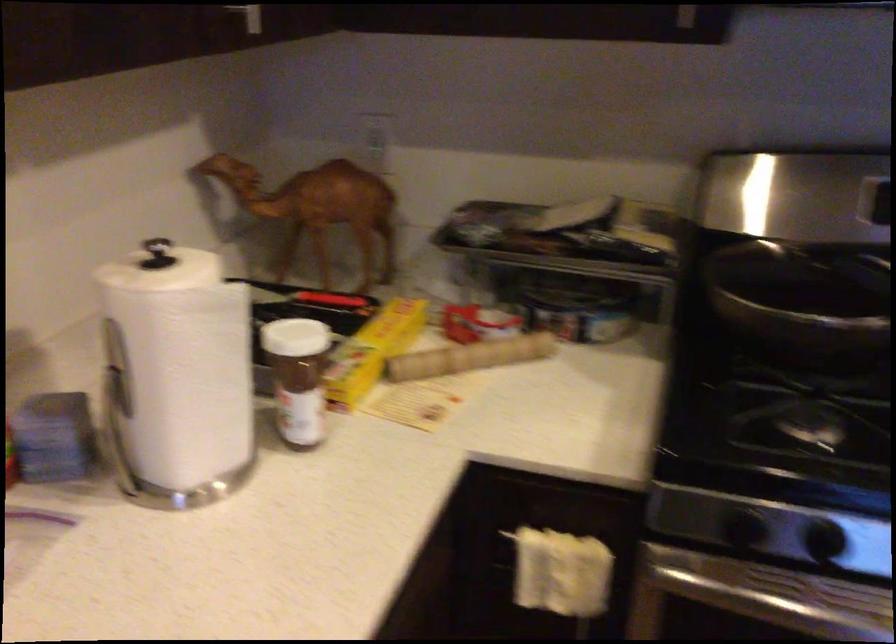
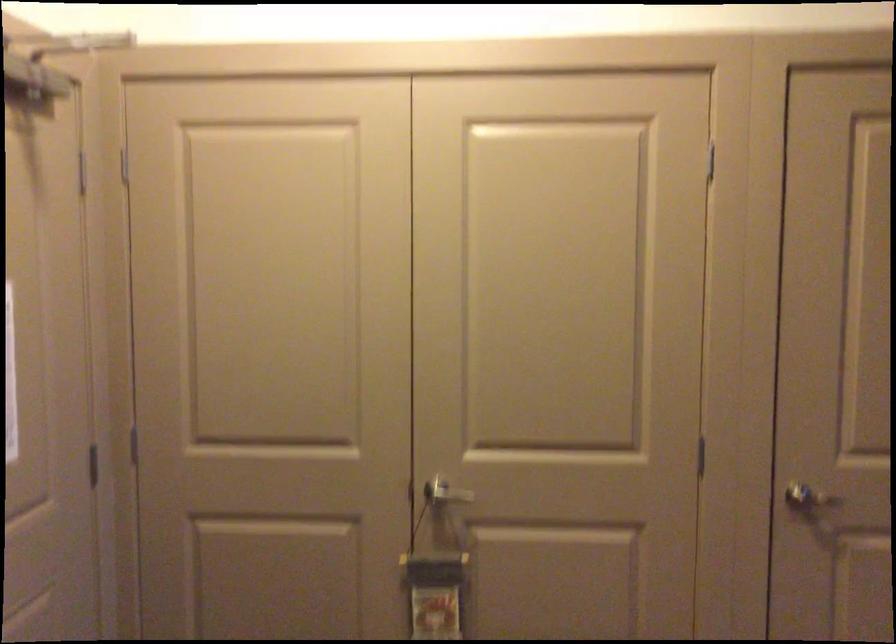
Question: The camera is either moving clockwise (left) or counter-clockwise (right) around the object. The first image is from the beginning of the video and the second image is from the end. Is the camera moving left or right when shooting the video?

Choices:
 (A) Left
 (B) Right

Answer: (A)